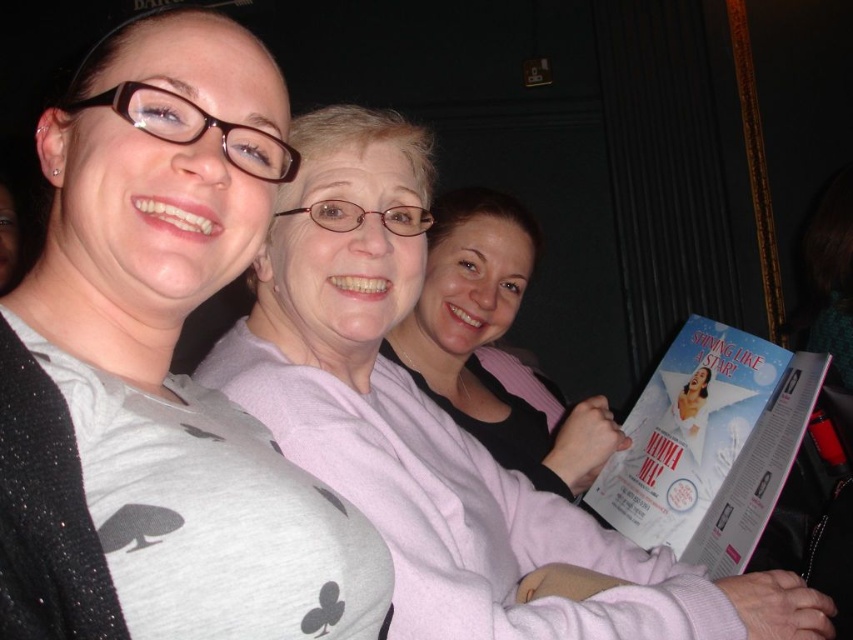
You are organizing a photo album and want to ensure that the gray matte shirt at upper left and the gray matte sweater at center are displayed in the correct order based on their size. Since the photo album requires items to be arranged from largest to smallest, which object should come first?

The gray matte sweater at center should come first because it occupies more space than the gray matte shirt at upper left, making it larger in size.

You are organizing a charity clothing drive and need to decide which items to donate. The gray matte shirt at upper left and the pink fabric sweater at center are both available. Based on their sizes, which one would be more suitable for someone needing a thicker garment?

The pink fabric sweater at center is thicker than the gray matte shirt at upper left, so it would be more suitable for someone needing a thicker garment.

You are at an event and want to take a photo of the white glossy book at center. To ensure the gray matte shirt at upper left doesn not block the view, which direction should you move your camera?

Move your camera to the right so the gray matte shirt at upper left is no longer blocking the view of the white glossy book at center.